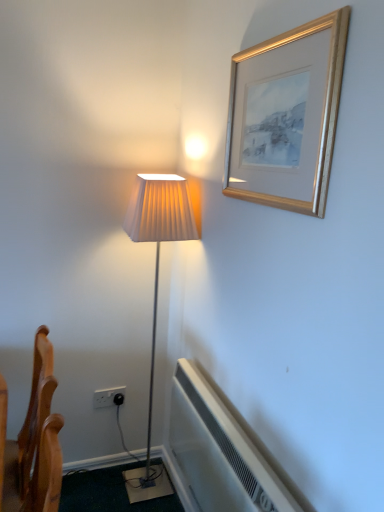
Question: Would you say white plastic electric outlet at lower left is to the left or to the right of gold metallic picture frame at upper right in the picture?

Choices:
 (A) right
 (B) left

Answer: (B)

Question: In terms of height, does white plastic electric outlet at lower left look taller or shorter compared to gold metallic picture frame at upper right?

Choices:
 (A) short
 (B) tall

Answer: (A)

Question: Considering the real-world distances, which object is closest to the white plastic electric outlet at lower left?

Choices:
 (A) wooden chair at lower left
 (B) white plastic air conditioner at lower center
 (C) gold metallic picture frame at upper right

Answer: (A)

Question: Based on their relative distances, which object is nearer to the white plastic air conditioner at lower center?

Choices:
 (A) wooden chair at lower left
 (B) white plastic electric outlet at lower left
 (C) gold metallic picture frame at upper right

Answer: (A)